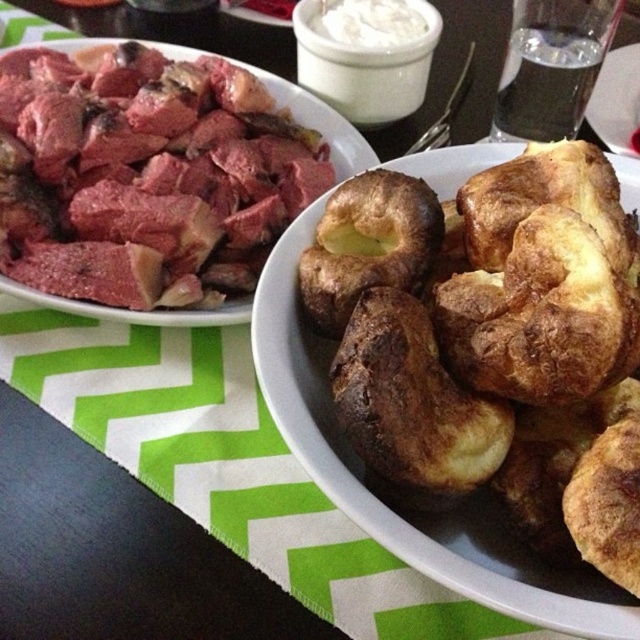
You are a food delivery person who needs to place a hot dish between the golden brown crusty yorkshire pudding at center and another object. The dish is 16 inches long. Can you fit it between them?

The distance between the golden brown crusty yorkshire pudding at center and the other object is 15.91 inches. The dish is 16 inches long, so it won not fit between them.

You are a food photographer who needs to capture both the golden brown crusty yorkshire pudding at center and the pinkish matte meat at upper left in the same frame. Which object should you focus on first to ensure proper depth of field?

The golden brown crusty yorkshire pudding at center should be focused on first because it is taller than the pinkish matte meat at upper left, ensuring both are in focus when starting with the taller object.